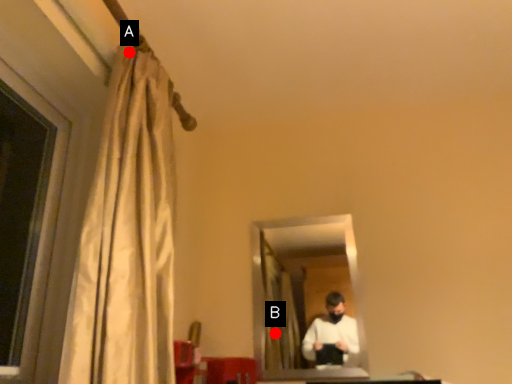
Question: Two points are circled on the image, labeled by A and B beside each circle. Among these points, which one is nearest to the camera?

Choices:
 (A) A is closer
 (B) B is closer

Answer: (A)